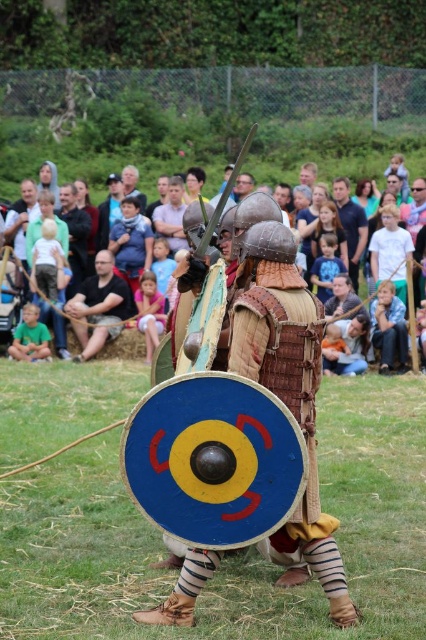
Is point (379, 164) closer to camera compared to point (354, 266)?

No, it is behind (354, 266).

You are a GUI agent. You are given a task and a screenshot of the screen. Output one action in this format:
    pyautogui.click(x=<x>, y=<y>)
    Task: Click on the light brown wooden bench at upper center
    This screenshot has height=640, width=426.
    Given the screenshot: What is the action you would take?
    pyautogui.click(x=351, y=168)

What are the coordinates of `light brown wooden bench at upper center` in the screenshot? It's located at (351, 168).

Is black leather pants at center smaller than brown leather armor at center?

Actually, black leather pants at center might be larger than brown leather armor at center.

Between point (88, 310) and point (337, 179), which one is positioned in front?

Point (88, 310) is in front.

The image size is (426, 640). I want to click on black leather pants at center, so [x=100, y=307].

Between point (94, 186) and point (89, 352), which one is positioned in front?

Point (89, 352)

This screenshot has height=640, width=426. What do you see at coordinates (351, 168) in the screenshot? I see `light brown wooden bench at upper center` at bounding box center [351, 168].

Which is behind, point (88, 173) or point (123, 317)?

The point (88, 173) is behind.

I want to click on light brown wooden bench at upper center, so click(x=351, y=168).